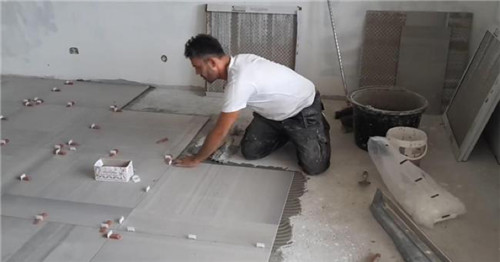
Identify the location of handle. Image resolution: width=500 pixels, height=262 pixels. (339, 75).